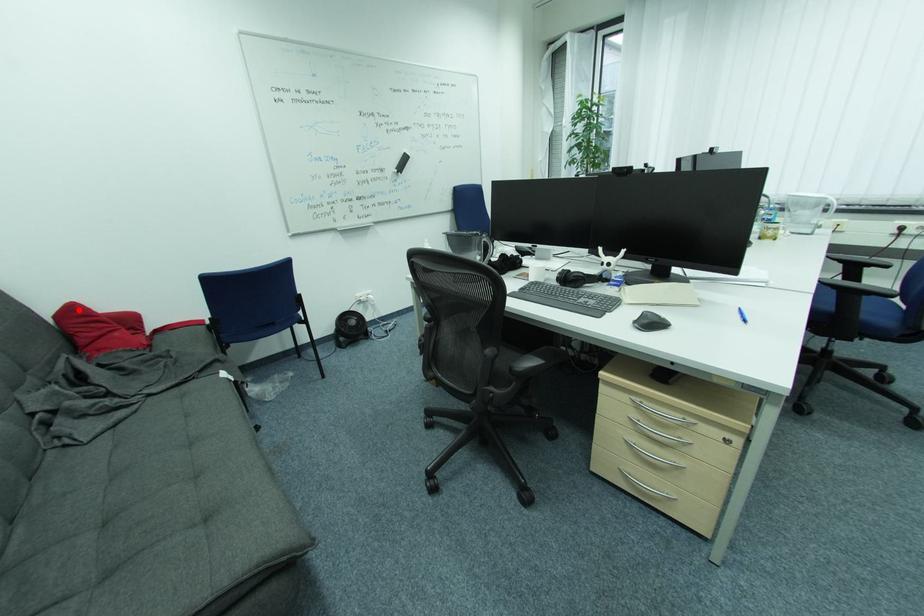
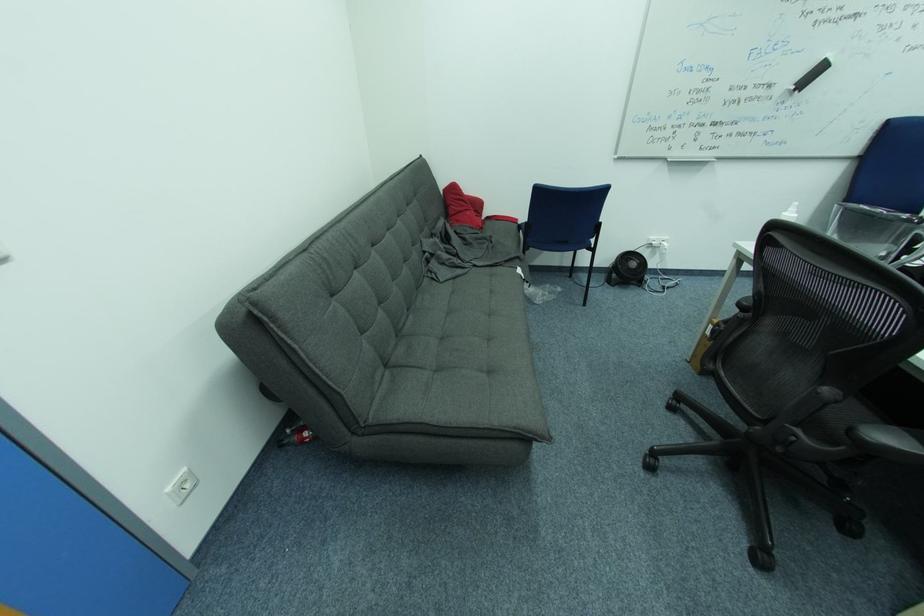
The point at the highlighted location is marked in the first image. Where is the corresponding point in the second image?

(459, 188)